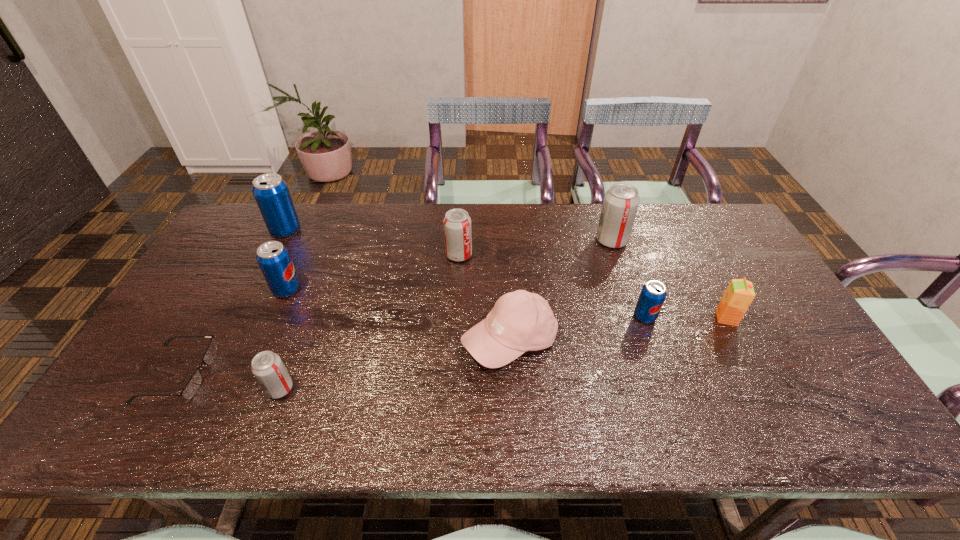
Locate an element on the screen. the smallest gray soda can is located at coordinates (267, 367).

The image size is (960, 540). I want to click on the leftmost gray soda can, so click(x=267, y=367).

Where is `spectacles`? This screenshot has width=960, height=540. spectacles is located at coordinates (194, 383).

At what (x,y) coordinates should I click in order to perform the action: click on the shortest object. Please return your answer as a coordinate pair (x, y). Looking at the image, I should click on (194, 383).

Where is `blank space located 0.180m on the right of the farthest blue pop soda`? Image resolution: width=960 pixels, height=540 pixels. blank space located 0.180m on the right of the farthest blue pop soda is located at coordinates pos(354,230).

This screenshot has height=540, width=960. What are the coordinates of `vacant space located 0.370m on the front of the biggest gray soda can` in the screenshot? It's located at (646, 343).

Image resolution: width=960 pixels, height=540 pixels. In order to click on blank space located 0.370m on the right of the second biggest gray soda can in this screenshot , I will do `click(588, 255)`.

At what (x,y) coordinates should I click in order to perform the action: click on vacant space situated on the front of the third nearest soda can. Please return your answer as a coordinate pair (x, y). This screenshot has width=960, height=540. Looking at the image, I should click on (258, 354).

At what (x,y) coordinates should I click in order to perform the action: click on free space located 0.170m on the back of the orange juice. Please return your answer as a coordinate pair (x, y). Looking at the image, I should click on (700, 268).

The image size is (960, 540). In order to click on free space located on the front-facing side of the baseball cap in this screenshot , I will do `click(515, 422)`.